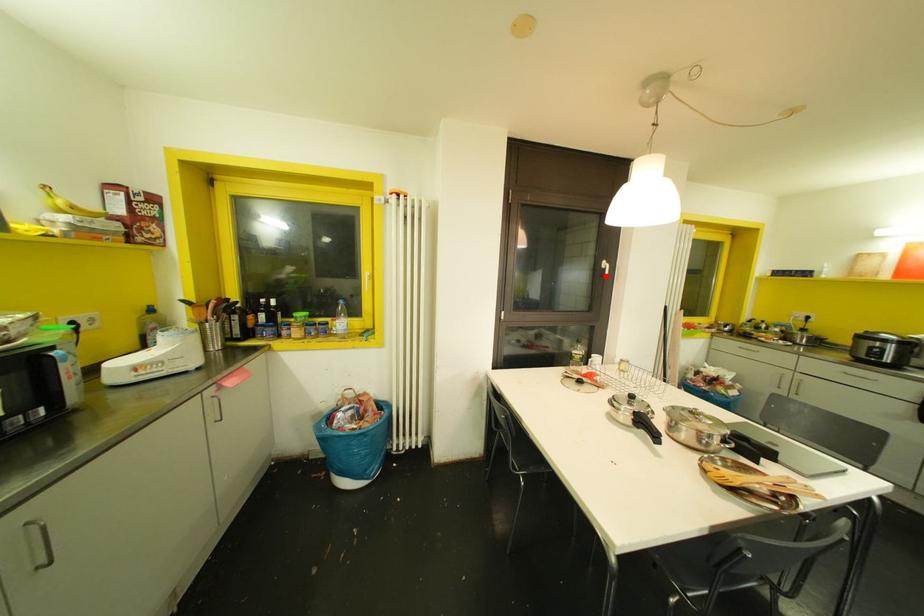
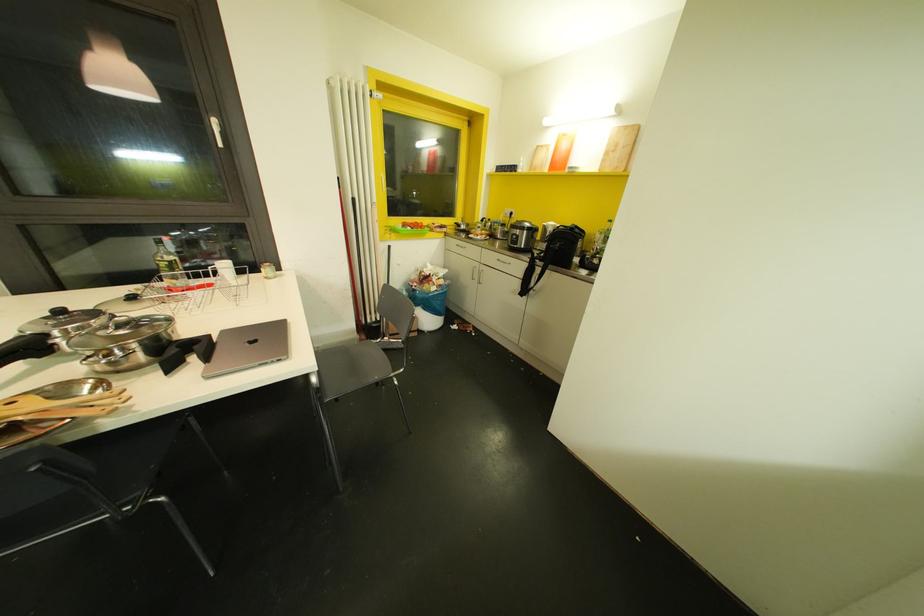
In the second image, find the point that corresponds to the highlighted location in the first image.

(220, 145)